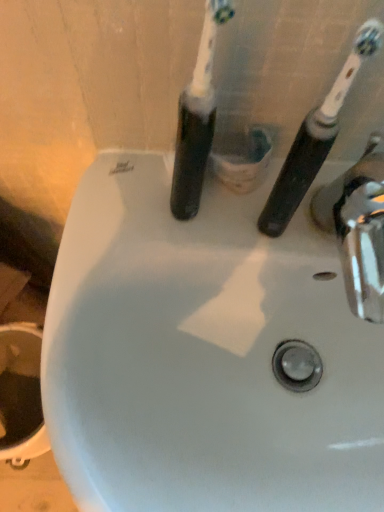
Question: Considering the relative sizes of black rubber toothbrush at upper right, which is the 2th toothbrush in left-to-right order, and black plastic toothbrush at center, placed as the first toothbrush when sorted from left to right, in the image provided, is black rubber toothbrush at upper right, which is the 2th toothbrush in left-to-right order, shorter than black plastic toothbrush at center, placed as the first toothbrush when sorted from left to right,?

Choices:
 (A) yes
 (B) no

Answer: (A)

Question: Does black rubber toothbrush at upper right, which appears as the first toothbrush when viewed from the right, touch black plastic toothbrush at center, arranged as the 2th toothbrush when viewed from the right?

Choices:
 (A) no
 (B) yes

Answer: (B)

Question: From a real-world perspective, is black rubber toothbrush at upper right, which is the 2th toothbrush in left-to-right order, over black plastic toothbrush at center, placed as the first toothbrush when sorted from left to right?

Choices:
 (A) yes
 (B) no

Answer: (B)

Question: Is black rubber toothbrush at upper right, which appears as the first toothbrush when viewed from the right, outside of black plastic toothbrush at center, arranged as the 2th toothbrush when viewed from the right?

Choices:
 (A) no
 (B) yes

Answer: (B)

Question: Is black rubber toothbrush at upper right, which appears as the first toothbrush when viewed from the right, positioned behind black plastic toothbrush at center, arranged as the 2th toothbrush when viewed from the right?

Choices:
 (A) no
 (B) yes

Answer: (B)

Question: Is black rubber toothbrush at upper right, which appears as the first toothbrush when viewed from the right, to the right of black plastic toothbrush at center, placed as the first toothbrush when sorted from left to right, from the viewer's perspective?

Choices:
 (A) no
 (B) yes

Answer: (B)

Question: Is chrome metallic tap at right turned away from black rubber toothbrush at upper right, which appears as the first toothbrush when viewed from the right?

Choices:
 (A) yes
 (B) no

Answer: (B)

Question: From the image's perspective, is chrome metallic tap at right on top of black rubber toothbrush at upper right, which is the 2th toothbrush in left-to-right order?

Choices:
 (A) no
 (B) yes

Answer: (A)

Question: Is chrome metallic tap at right completely or partially outside of black rubber toothbrush at upper right, which appears as the first toothbrush when viewed from the right?

Choices:
 (A) yes
 (B) no

Answer: (A)

Question: Is chrome metallic tap at right further to camera compared to black rubber toothbrush at upper right, which appears as the first toothbrush when viewed from the right?

Choices:
 (A) no
 (B) yes

Answer: (B)

Question: Does chrome metallic tap at right have a greater width compared to black rubber toothbrush at upper right, which appears as the first toothbrush when viewed from the right?

Choices:
 (A) no
 (B) yes

Answer: (B)

Question: Can you confirm if chrome metallic tap at right is positioned to the left of black rubber toothbrush at upper right, which appears as the first toothbrush when viewed from the right?

Choices:
 (A) yes
 (B) no

Answer: (B)

Question: Is chrome metallic tap at right taller than black plastic toothbrush at center, placed as the first toothbrush when sorted from left to right?

Choices:
 (A) no
 (B) yes

Answer: (A)